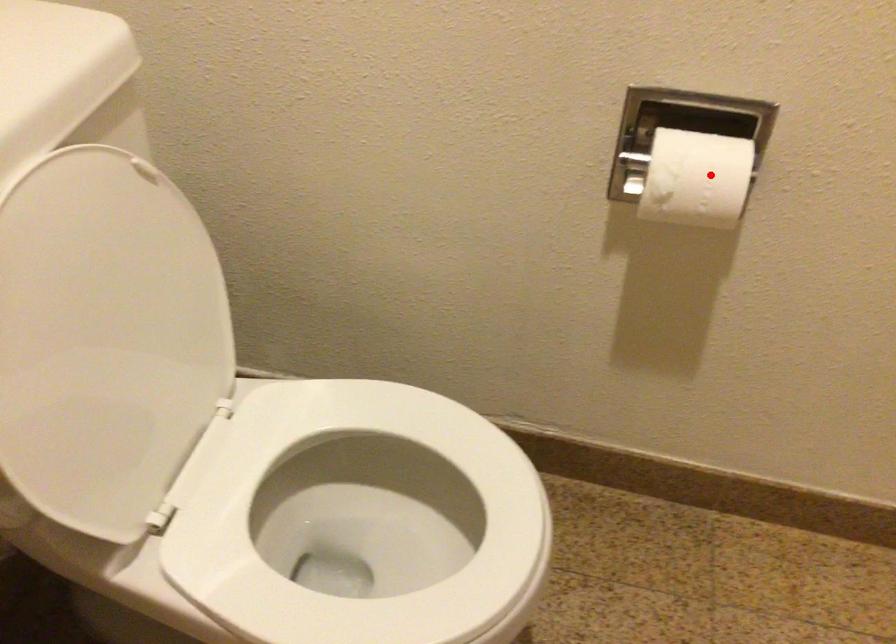
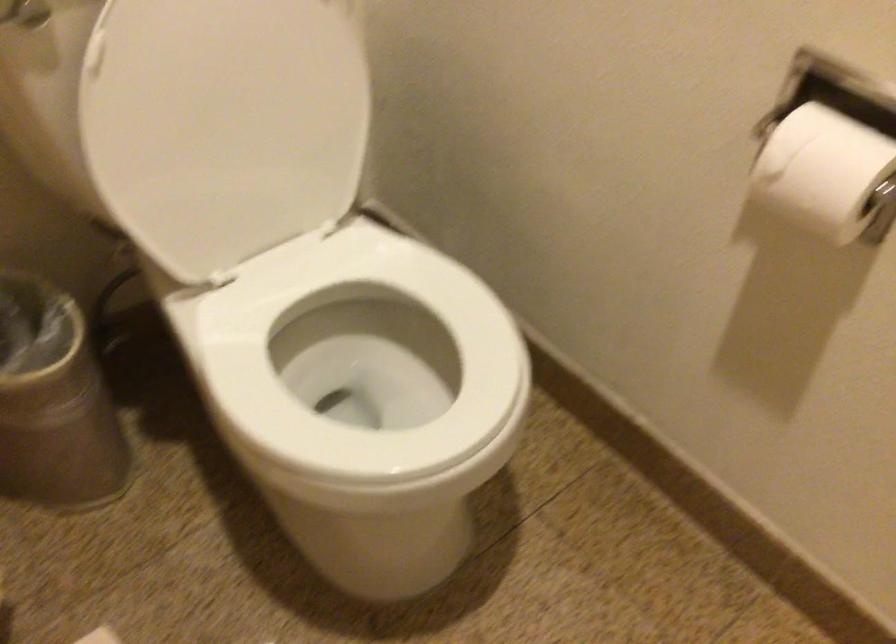
In the second image, find the point that corresponds to the highlighted location in the first image.

(824, 172)